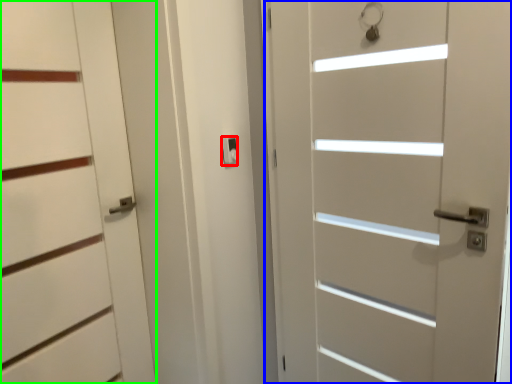
Question: Estimate the real-world distances between objects in this image. Which object is closer to latch (highlighted by a red box), door (highlighted by a blue box) or door (highlighted by a green box)?

Choices:
 (A) door
 (B) door

Answer: (B)